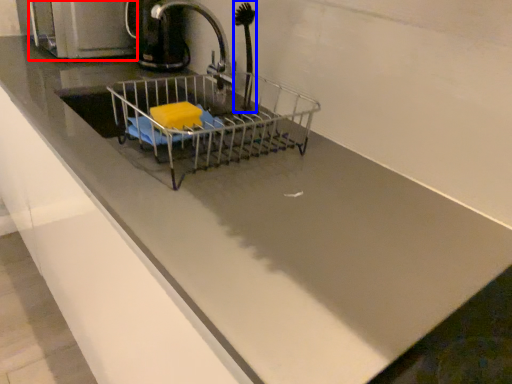
Question: Which point is further to the camera, appliance (highlighted by a red box) or brush (highlighted by a blue box)?

Choices:
 (A) appliance
 (B) brush

Answer: (A)